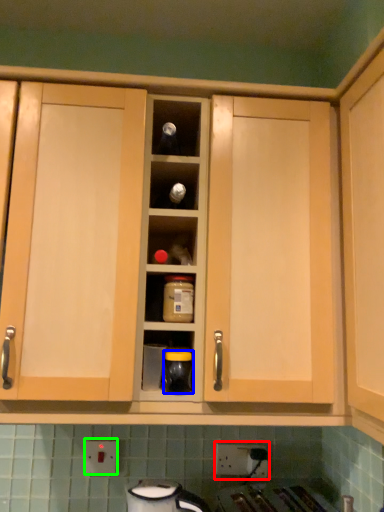
Question: Which is nearer to the electric outlet (highlighted by a red box)? appliance (highlighted by a blue box) or electric outlet (highlighted by a green box).

Choices:
 (A) appliance
 (B) electric outlet

Answer: (B)